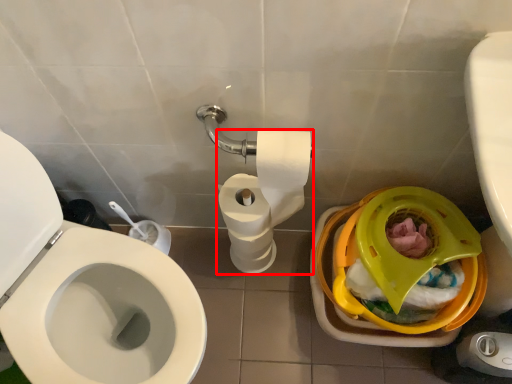
Question: From the image, what is the correct spatial relationship of toilet paper (annotated by the red box) in relation to potty?

Choices:
 (A) left
 (B) right

Answer: (A)